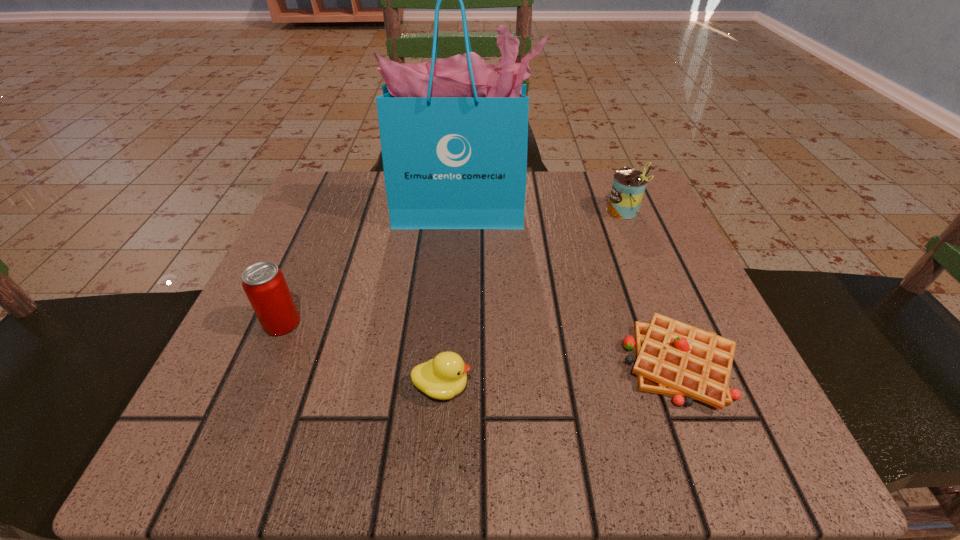
Find the location of a particular element. vacant area that lies between the right can and the tallest object is located at coordinates click(x=543, y=212).

This screenshot has height=540, width=960. In order to click on free space between the shopping bag and the nearer can in this screenshot , I will do `click(372, 268)`.

What are the coordinates of `vacant space that's between the shortest object and the duckling` in the screenshot? It's located at (562, 375).

In order to click on vacant space that is in between the nearer can and the shortest object in this screenshot , I will do `click(481, 343)`.

What are the coordinates of `vacant point located between the right can and the left can` in the screenshot? It's located at (454, 267).

Find the location of a particular element. vacant space that's between the leftmost object and the tallest object is located at coordinates (372, 268).

Identify which object is located as the second nearest to the farther can. Please provide its 2D coordinates. Your answer should be formatted as a tuple, i.e. [(x, y)], where the tuple contains the x and y coordinates of a point satisfying the conditions above.

[(673, 358)]

Where is `object that is the closest to the duckling`? The image size is (960, 540). object that is the closest to the duckling is located at coordinates (264, 284).

Where is `free space in the image that satisfies the following two spatial constraints: 1. on the front side of the waffle; 2. on the right side of the nearer can`? This screenshot has width=960, height=540. free space in the image that satisfies the following two spatial constraints: 1. on the front side of the waffle; 2. on the right side of the nearer can is located at coordinates pos(264,364).

You are a GUI agent. You are given a task and a screenshot of the screen. Output one action in this format:
    pyautogui.click(x=<x>, y=<y>)
    Task: Click on the vacant point that satisfies the following two spatial constraints: 1. on the front side of the tallest object; 2. on the beak of the duckling
    This screenshot has width=960, height=540.
    Given the screenshot: What is the action you would take?
    pyautogui.click(x=452, y=387)